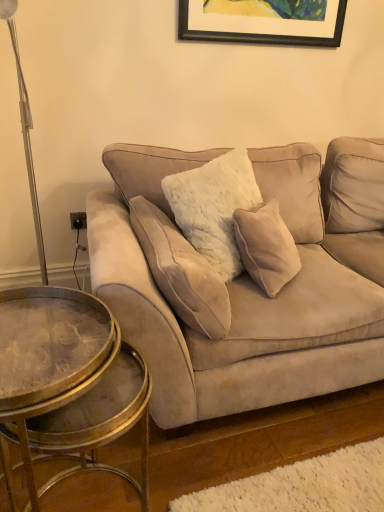
Question: From the image's perspective, would you say velvet beige pillow at center is shown under suede couch at center?

Choices:
 (A) yes
 (B) no

Answer: (A)

Question: Would you say velvet beige pillow at center contains suede couch at center?

Choices:
 (A) yes
 (B) no

Answer: (B)

Question: Does velvet beige pillow at center appear on the left side of suede couch at center?

Choices:
 (A) no
 (B) yes

Answer: (B)

Question: Is velvet beige pillow at center closer to the viewer compared to suede couch at center?

Choices:
 (A) yes
 (B) no

Answer: (B)

Question: Can you confirm if velvet beige pillow at center is taller than suede couch at center?

Choices:
 (A) yes
 (B) no

Answer: (B)

Question: Does velvet beige pillow at center have a lesser height compared to suede couch at center?

Choices:
 (A) no
 (B) yes

Answer: (B)

Question: Is metallic glass coffee table at lower left at the right side of suede couch at center?

Choices:
 (A) no
 (B) yes

Answer: (A)

Question: Is metallic glass coffee table at lower left to the left of suede couch at center from the viewer's perspective?

Choices:
 (A) no
 (B) yes

Answer: (B)

Question: From the image's perspective, is metallic glass coffee table at lower left on top of suede couch at center?

Choices:
 (A) yes
 (B) no

Answer: (B)

Question: Considering the relative sizes of metallic glass coffee table at lower left and suede couch at center in the image provided, is metallic glass coffee table at lower left thinner than suede couch at center?

Choices:
 (A) no
 (B) yes

Answer: (B)

Question: Is metallic glass coffee table at lower left beside suede couch at center?

Choices:
 (A) yes
 (B) no

Answer: (B)

Question: Is metallic glass coffee table at lower left facing towards suede couch at center?

Choices:
 (A) yes
 (B) no

Answer: (B)

Question: From a real-world perspective, is velvet beige pillow at center positioned under metallic glass coffee table at lower left based on gravity?

Choices:
 (A) yes
 (B) no

Answer: (B)